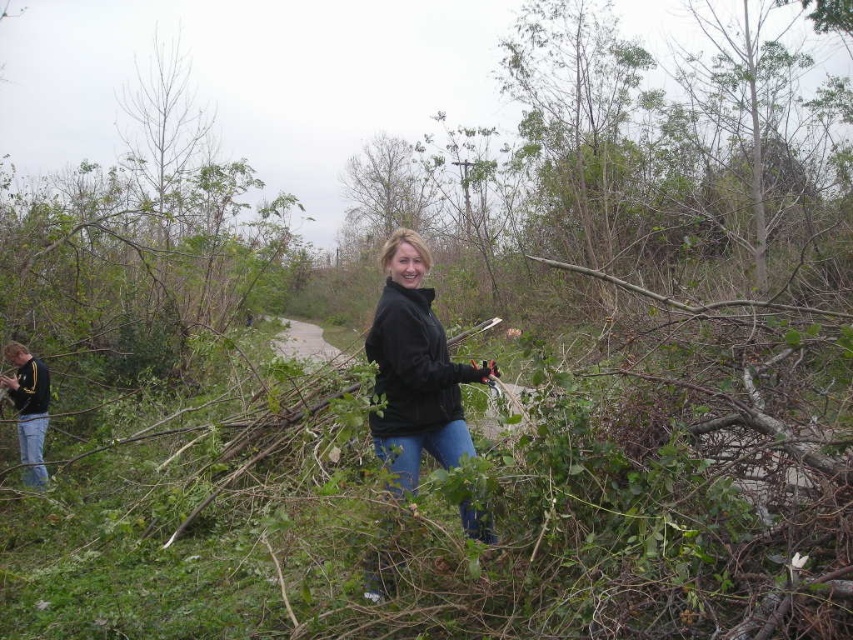
Question: Is black matte jacket at center smaller than jeans at left?

Choices:
 (A) yes
 (B) no

Answer: (B)

Question: Is black matte jacket at center thinner than jeans at left?

Choices:
 (A) no
 (B) yes

Answer: (B)

Question: Can you confirm if black matte jacket at center is wider than jeans at left?

Choices:
 (A) yes
 (B) no

Answer: (B)

Question: Which point is farther to the camera?

Choices:
 (A) (381, 444)
 (B) (19, 424)

Answer: (B)